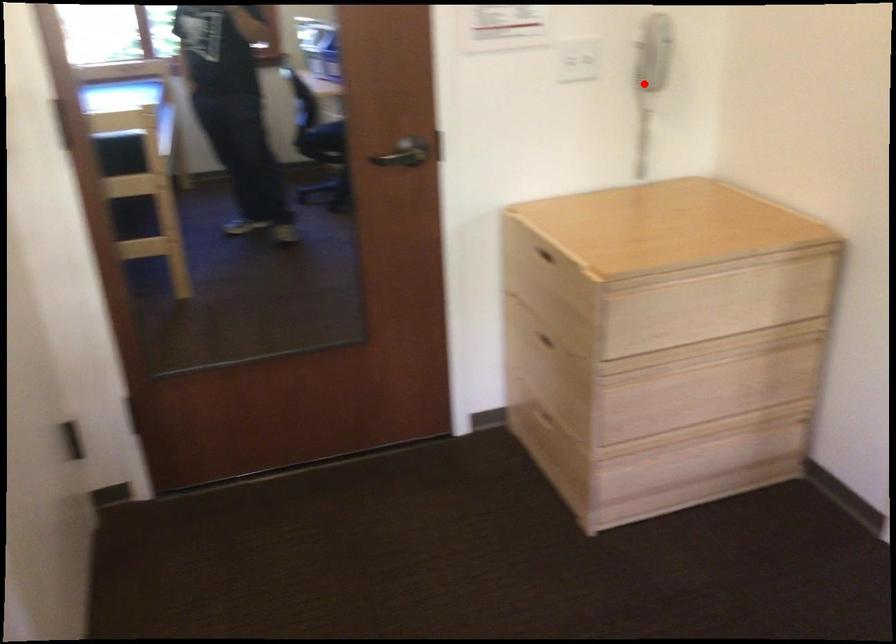
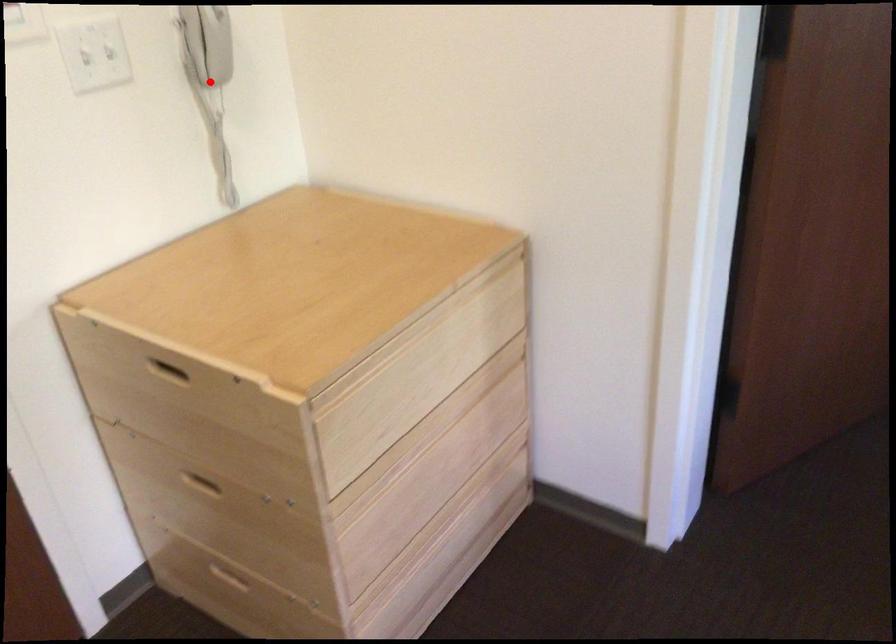
I am providing you with two images of the same scene from different viewpoints. A red point is marked on the first image and another point is marked on the second image. Does the point marked in image1 correspond to the same location as the one in image2?

Yes